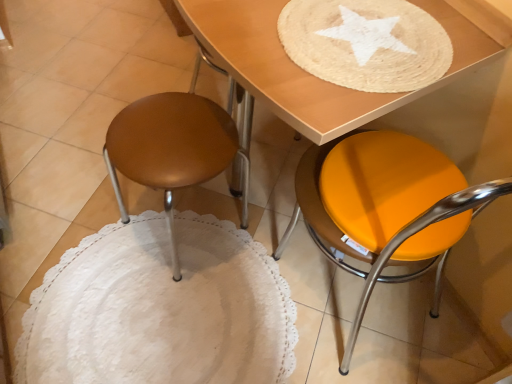
Image resolution: width=512 pixels, height=384 pixels. I want to click on free space between matte brown stool at left and orange matte stool at lower right, so click(x=259, y=273).